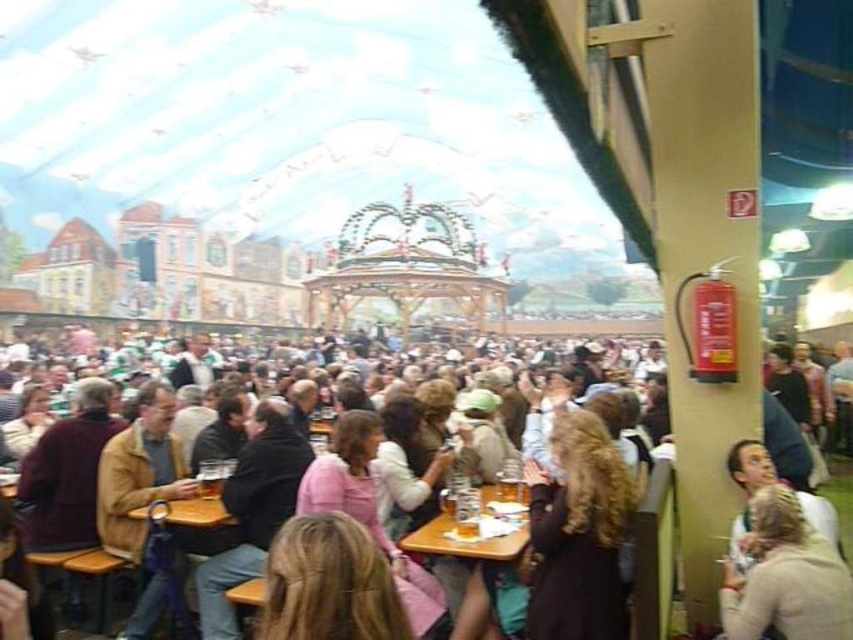
Can you confirm if matte brown jacket at center is wider than wooden table at center?

Correct, the width of matte brown jacket at center exceeds that of wooden table at center.

Which is behind, point (187, 538) or point (426, 532)?

The point (426, 532) is more distant.

Where is `matte brown jacket at center`? This screenshot has height=640, width=853. matte brown jacket at center is located at coordinates (90, 496).